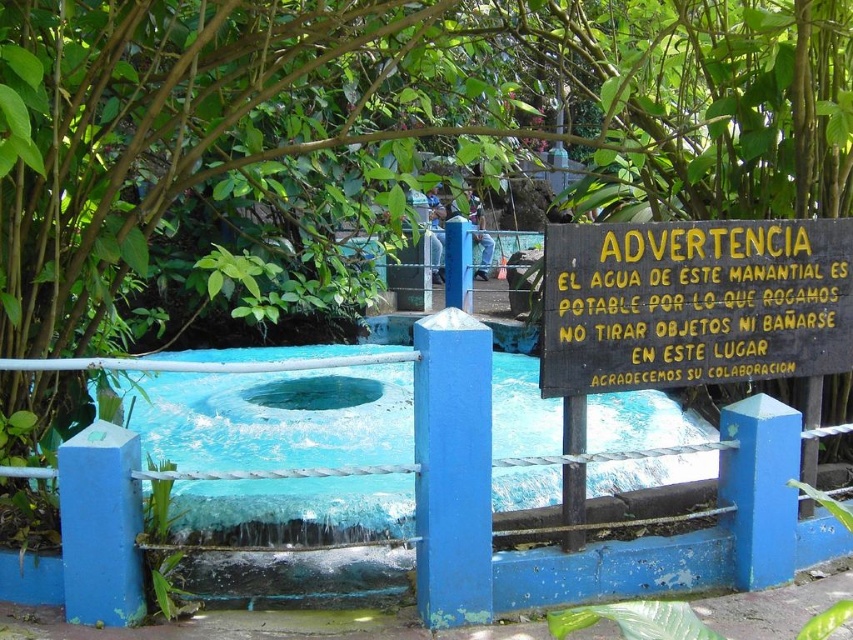
Does blue concrete pool at center have a lesser height compared to black wood sign at center?

Yes, blue concrete pool at center is shorter than black wood sign at center.

Can you confirm if blue concrete pool at center is positioned to the left of black wood sign at center?

Answer: Correct, you'll find blue concrete pool at center to the left of black wood sign at center.

Who is more distant from viewer, (514, 541) or (682, 280)?

Positioned behind is point (514, 541).

Locate an element on the screen. This screenshot has height=640, width=853. blue concrete pool at center is located at coordinates (277, 419).